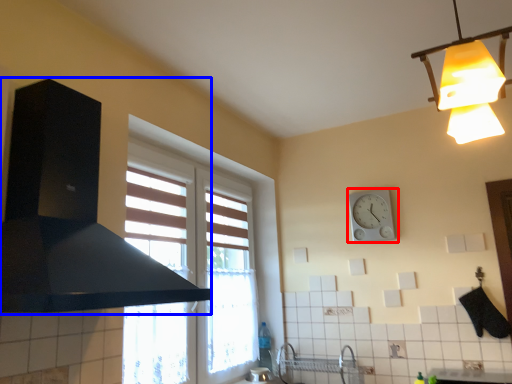
Question: Which of the following is the closest to the observer, wall clock (highlighted by a red box) or exhaust hood (highlighted by a blue box)?

Choices:
 (A) wall clock
 (B) exhaust hood

Answer: (B)